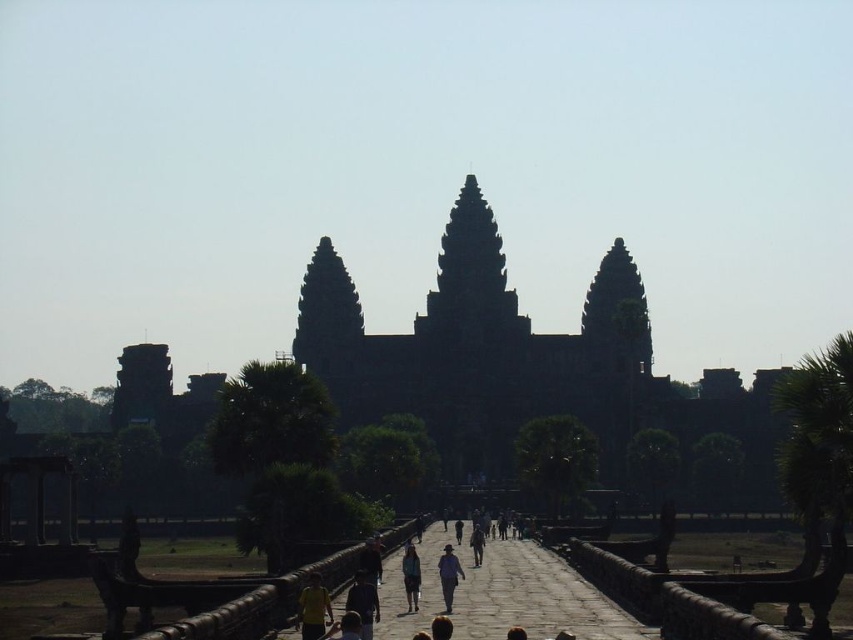
You are a tourist visiting the ancient temple complex. You see a yellow fabric person at lower center and a dark blue jeans at center. Which of these two objects is narrower?

The yellow fabric person at lower center has a lesser width compared to dark blue jeans at center, so the yellow fabric person at lower center is narrower.

You are standing at the entrance of the temple complex and see a yellow fabric person at lower center and a dark blue jeans at center. Which one is nearer to you?

The yellow fabric person at lower center is closer to the viewer than the dark blue jeans at center, so the yellow fabric person at lower center is nearer to you.

You are a tourist standing at the entrance of the temple complex. You see a person with dark brown hair at center and a blue fabric person at center. Which of these two people has a wider appearance?

The dark brown hair at center might be wider than blue fabric person at center.